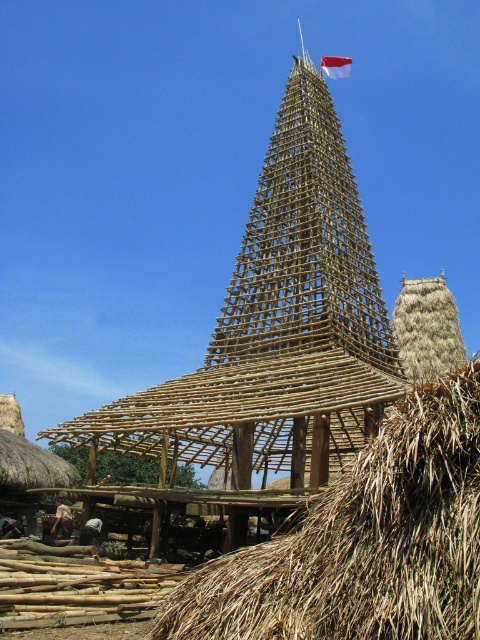
Is brown thatch at center positioned before red fabric flag at upper center?

Yes, brown thatch at center is closer to the viewer.

Can you confirm if brown thatch at center is shorter than red fabric flag at upper center?

In fact, brown thatch at center may be taller than red fabric flag at upper center.

Where is `brown thatch at center`? brown thatch at center is located at coordinates (362, 541).

The height and width of the screenshot is (640, 480). I want to click on brown thatch at center, so click(x=362, y=541).